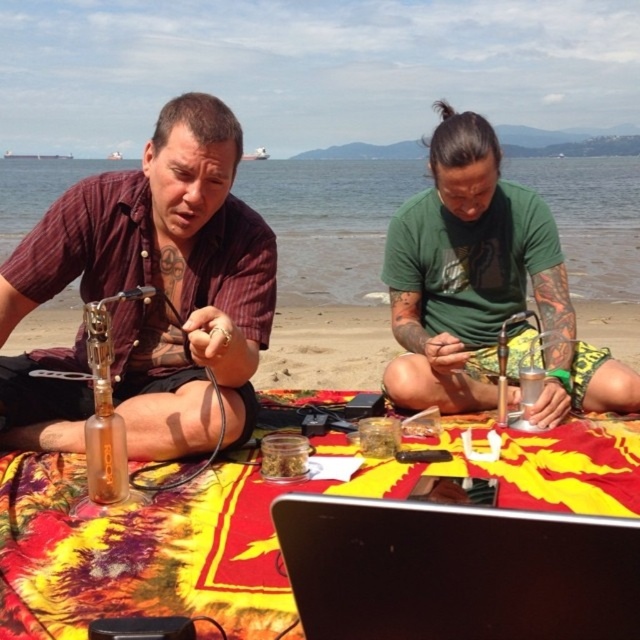
Looking at this image, you are a photographer trying to capture both the matte glass bottle at left and the black matte laptop at lower center in a single frame. Based on their sizes, which object should you position closer to the camera to ensure both fit well in the photo?

Since the matte glass bottle at left is larger than the black matte laptop at lower center, you should position the black matte laptop at lower center closer to the camera to balance their sizes in the frame.